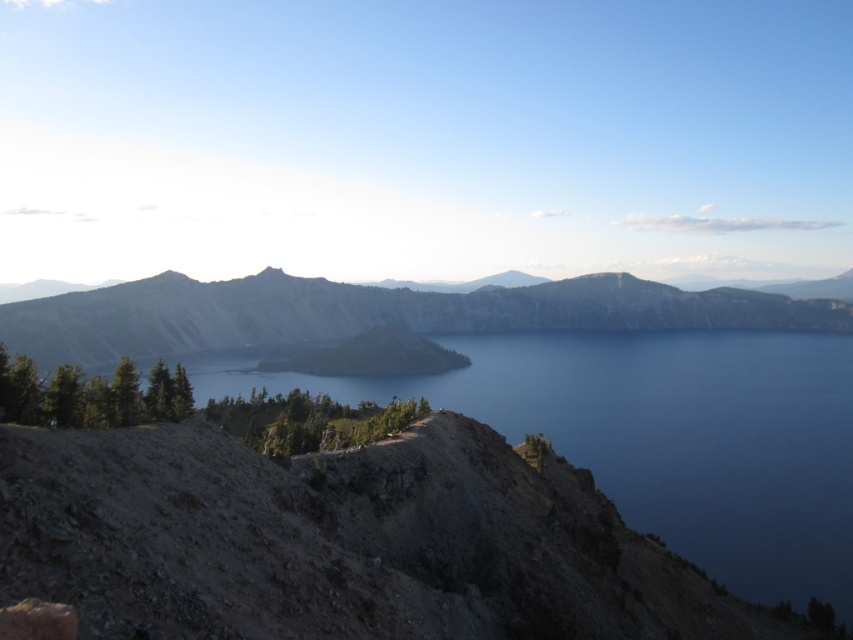
Is blue water at center below gray rocky mountain at center?

Yes.

Does blue water at center have a greater height compared to gray rocky mountain at center?

No, blue water at center is not taller than gray rocky mountain at center.

Is point (581, 362) closer to viewer compared to point (494, 324)?

That is True.

At what (x,y) coordinates should I click in order to perform the action: click on blue water at center. Please return your answer as a coordinate pair (x, y). Looking at the image, I should click on (666, 436).